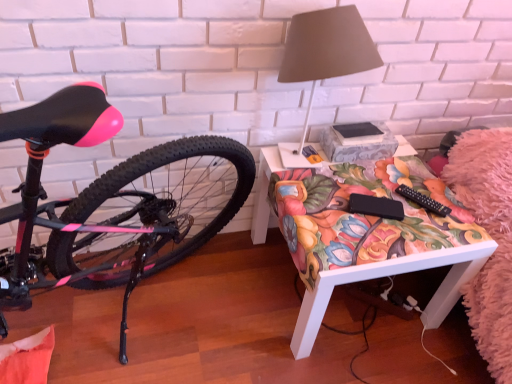
Locate an element on the screen. Image resolution: width=512 pixels, height=384 pixels. empty space that is in between black plastic remote control at lower right and matte gray lampshade at upper right is located at coordinates (371, 190).